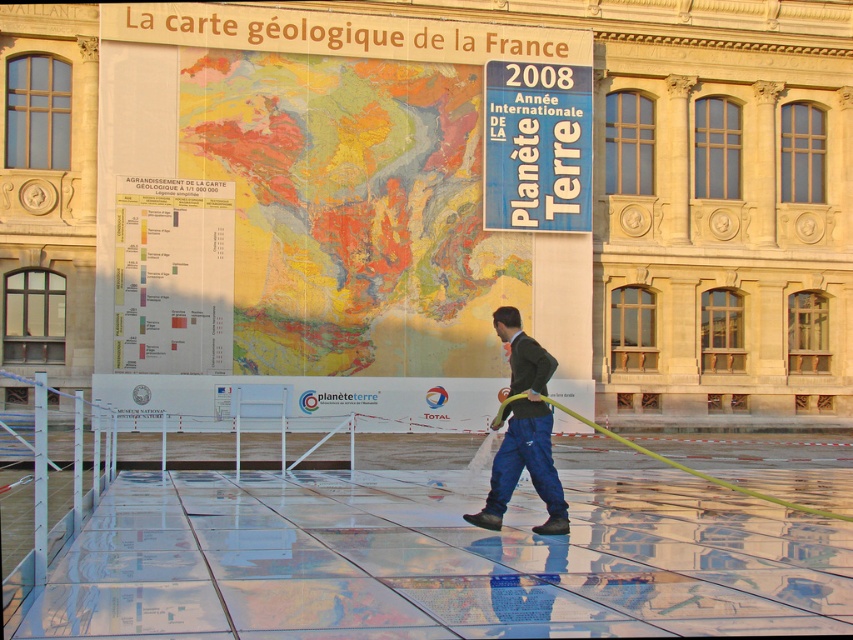
Question: Can you confirm if dark green sweater at center is bigger than green rubber hose at center?

Choices:
 (A) yes
 (B) no

Answer: (B)

Question: Which point is farther to the camera?

Choices:
 (A) coord(532,342)
 (B) coord(641,448)

Answer: (B)

Question: Does dark green sweater at center have a lesser width compared to green rubber hose at center?

Choices:
 (A) yes
 (B) no

Answer: (A)

Question: Considering the relative positions of dark green sweater at center and green rubber hose at center in the image provided, where is dark green sweater at center located with respect to green rubber hose at center?

Choices:
 (A) above
 (B) below

Answer: (A)

Question: Which object appears farthest from the camera in this image?

Choices:
 (A) green rubber hose at center
 (B) dark green sweater at center

Answer: (B)